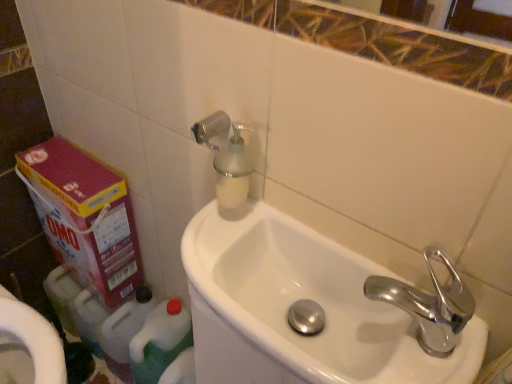
The width and height of the screenshot is (512, 384). In order to click on green plastic bottle at lower left, which ranks as the 2th cleaning product in right-to-left order in this screenshot , I will do `click(124, 332)`.

The height and width of the screenshot is (384, 512). Describe the element at coordinates (84, 217) in the screenshot. I see `pink cardboard box at lower left` at that location.

Describe the element at coordinates (309, 297) in the screenshot. I see `white glossy sink at center` at that location.

Image resolution: width=512 pixels, height=384 pixels. Describe the element at coordinates (227, 158) in the screenshot. I see `silver metallic soap dispenser at upper center` at that location.

At what (x,y) coordinates should I click in order to perform the action: click on green plastic bottle at lower left, which is the 2th cleaning product in left-to-right order. Please return your answer as a coordinate pair (x, y). The height and width of the screenshot is (384, 512). Looking at the image, I should click on (160, 341).

This screenshot has width=512, height=384. What do you see at coordinates (160, 341) in the screenshot?
I see `green plastic bottle at lower left, which ranks as the 1th cleaning product in right-to-left order` at bounding box center [160, 341].

The image size is (512, 384). Find the location of `green plastic bottle at lower left, which ranks as the 2th cleaning product in right-to-left order`. green plastic bottle at lower left, which ranks as the 2th cleaning product in right-to-left order is located at coordinates (124, 332).

From the image's perspective, which one is positioned higher, green plastic bottle at lower left, the first cleaning product positioned from the left, or silver metallic soap dispenser at upper center?

From the image's view, silver metallic soap dispenser at upper center is above.

Does green plastic bottle at lower left, the first cleaning product positioned from the left, have a smaller size compared to silver metallic soap dispenser at upper center?

No, green plastic bottle at lower left, the first cleaning product positioned from the left, is not smaller than silver metallic soap dispenser at upper center.

Could you tell me if green plastic bottle at lower left, which ranks as the 2th cleaning product in right-to-left order, is facing silver metallic soap dispenser at upper center?

No, green plastic bottle at lower left, which ranks as the 2th cleaning product in right-to-left order, is not oriented towards silver metallic soap dispenser at upper center.

From a real-world perspective, is green plastic bottle at lower left, the first cleaning product positioned from the left, positioned under pink cardboard box at lower left based on gravity?

Indeed, from a real-world perspective, green plastic bottle at lower left, the first cleaning product positioned from the left, is positioned beneath pink cardboard box at lower left.

Is green plastic bottle at lower left, which ranks as the 2th cleaning product in right-to-left order, not inside pink cardboard box at lower left?

green plastic bottle at lower left, which ranks as the 2th cleaning product in right-to-left order, lies outside pink cardboard box at lower left's area.

What's the angular difference between green plastic bottle at lower left, the first cleaning product positioned from the left, and pink cardboard box at lower left's facing directions?

There is a 1.18-degree angle between the facing directions of green plastic bottle at lower left, the first cleaning product positioned from the left, and pink cardboard box at lower left.

From the image's perspective, between chrome metallic faucet at right and white glossy sink at center, which one is located above?

From the image's view, chrome metallic faucet at right is above.

From a real-world perspective, is chrome metallic faucet at right positioned above or below white glossy sink at center?

chrome metallic faucet at right is above white glossy sink at center.

Is chrome metallic faucet at right located outside white glossy sink at center?

Indeed, chrome metallic faucet at right is completely outside white glossy sink at center.

Considering the relative positions of chrome metallic faucet at right and white glossy sink at center in the image provided, is chrome metallic faucet at right to the left of white glossy sink at center from the viewer's perspective?

No.

This screenshot has width=512, height=384. I want to click on sink that appears on the right of pink cardboard box at lower left, so click(309, 297).

From the picture: Does pink cardboard box at lower left turn towards white glossy sink at center?

No, pink cardboard box at lower left does not turn towards white glossy sink at center.

Is point (125, 295) behind point (269, 340)?

Yes.

Considering the sizes of objects pink cardboard box at lower left and silver metallic soap dispenser at upper center in the image provided, who is shorter, pink cardboard box at lower left or silver metallic soap dispenser at upper center?

Standing shorter between the two is silver metallic soap dispenser at upper center.

From a real-world perspective, between pink cardboard box at lower left and silver metallic soap dispenser at upper center, who is vertically higher?

In real-world perspective, silver metallic soap dispenser at upper center is above.

Which is behind, pink cardboard box at lower left or silver metallic soap dispenser at upper center?

pink cardboard box at lower left is more distant.

Does point (116, 191) appear closer or farther from the camera than point (122, 341)?

Point (116, 191) is positioned closer to the camera compared to point (122, 341).

How different are the orientations of pink cardboard box at lower left and green plastic bottle at lower left, the first cleaning product positioned from the left, in degrees?

The angle between the facing direction of pink cardboard box at lower left and the facing direction of green plastic bottle at lower left, the first cleaning product positioned from the left, is 1.18 degrees.

Does pink cardboard box at lower left have a lesser width compared to green plastic bottle at lower left, the first cleaning product positioned from the left?

Correct, the width of pink cardboard box at lower left is less than that of green plastic bottle at lower left, the first cleaning product positioned from the left.

From a real-world perspective, is pink cardboard box at lower left positioned above or below green plastic bottle at lower left, the first cleaning product positioned from the left?

Clearly, from a real-world perspective, pink cardboard box at lower left is above green plastic bottle at lower left, the first cleaning product positioned from the left.

Between green plastic bottle at lower left, which is the 2th cleaning product in left-to-right order, and pink cardboard box at lower left, which one has less height?

Standing shorter between the two is green plastic bottle at lower left, which is the 2th cleaning product in left-to-right order.

From the image's perspective, is green plastic bottle at lower left, which is the 2th cleaning product in left-to-right order, on pink cardboard box at lower left?

Incorrect, from the image's perspective, green plastic bottle at lower left, which is the 2th cleaning product in left-to-right order, is lower than pink cardboard box at lower left.

Which cleaning product is the 2nd one when counting from the right side of the pink cardboard box at lower left? Please provide its 2D coordinates.

[(160, 341)]

Considering the positions of point (168, 361) and point (141, 274), is point (168, 361) closer or farther from the camera than point (141, 274)?

Point (168, 361) appears to be closer to the viewer than point (141, 274).

This screenshot has height=384, width=512. Identify the location of cleaning product that is the 1st object located below the silver metallic soap dispenser at upper center (from the image's perspective). (124, 332).

Starting from the pink cardboard box at lower left, which cleaning product is the 1st one to the right? Please provide its 2D coordinates.

[(124, 332)]

When comparing their distances from chrome metallic faucet at right, does silver metallic soap dispenser at upper center or green plastic bottle at lower left, the first cleaning product positioned from the left, seem closer?

Among the two, silver metallic soap dispenser at upper center is located nearer to chrome metallic faucet at right.

Considering their positions, is silver metallic soap dispenser at upper center positioned further to green plastic bottle at lower left, the first cleaning product positioned from the left, than pink cardboard box at lower left?

Among the two, silver metallic soap dispenser at upper center is located further to green plastic bottle at lower left, the first cleaning product positioned from the left.

From the image, which object appears to be nearer to pink cardboard box at lower left, green plastic bottle at lower left, which ranks as the 1th cleaning product in right-to-left order, or chrome metallic faucet at right?

green plastic bottle at lower left, which ranks as the 1th cleaning product in right-to-left order.

Based on their spatial positions, is pink cardboard box at lower left or silver metallic soap dispenser at upper center closer to green plastic bottle at lower left, which ranks as the 2th cleaning product in right-to-left order?

The object closer to green plastic bottle at lower left, which ranks as the 2th cleaning product in right-to-left order, is pink cardboard box at lower left.

Looking at this image, looking at the image, which one is located further to green plastic bottle at lower left, which ranks as the 2th cleaning product in right-to-left order, white glossy sink at center or silver metallic soap dispenser at upper center?

silver metallic soap dispenser at upper center lies further to green plastic bottle at lower left, which ranks as the 2th cleaning product in right-to-left order, than the other object.

Based on their spatial positions, is green plastic bottle at lower left, which is the 2th cleaning product in left-to-right order, or white glossy sink at center further from pink cardboard box at lower left?

white glossy sink at center is further to pink cardboard box at lower left.

Estimate the real-world distances between objects in this image. Which object is closer to silver metallic soap dispenser at upper center, green plastic bottle at lower left, which ranks as the 1th cleaning product in right-to-left order, or chrome metallic faucet at right?

chrome metallic faucet at right is closer to silver metallic soap dispenser at upper center.

When comparing their distances from green plastic bottle at lower left, which ranks as the 2th cleaning product in right-to-left order, does silver metallic soap dispenser at upper center or chrome metallic faucet at right seem further?

chrome metallic faucet at right is further to green plastic bottle at lower left, which ranks as the 2th cleaning product in right-to-left order.

This screenshot has width=512, height=384. I want to click on plumbing fixture between white glossy sink at center and green plastic bottle at lower left, the first cleaning product positioned from the left, in the front-back direction, so click(x=227, y=158).

Locate an element on the screen. This screenshot has width=512, height=384. plumbing fixture between pink cardboard box at lower left and white glossy sink at center in the horizontal direction is located at coordinates (227, 158).

At what (x,y) coordinates should I click in order to perform the action: click on carton between silver metallic soap dispenser at upper center and green plastic bottle at lower left, which is the 2th cleaning product in left-to-right order, in the up-down direction. Please return your answer as a coordinate pair (x, y). Looking at the image, I should click on (84, 217).

This screenshot has height=384, width=512. Find the location of `cleaning product between silver metallic soap dispenser at upper center and green plastic bottle at lower left, which ranks as the 1th cleaning product in right-to-left order, from top to bottom`. cleaning product between silver metallic soap dispenser at upper center and green plastic bottle at lower left, which ranks as the 1th cleaning product in right-to-left order, from top to bottom is located at coordinates (124, 332).